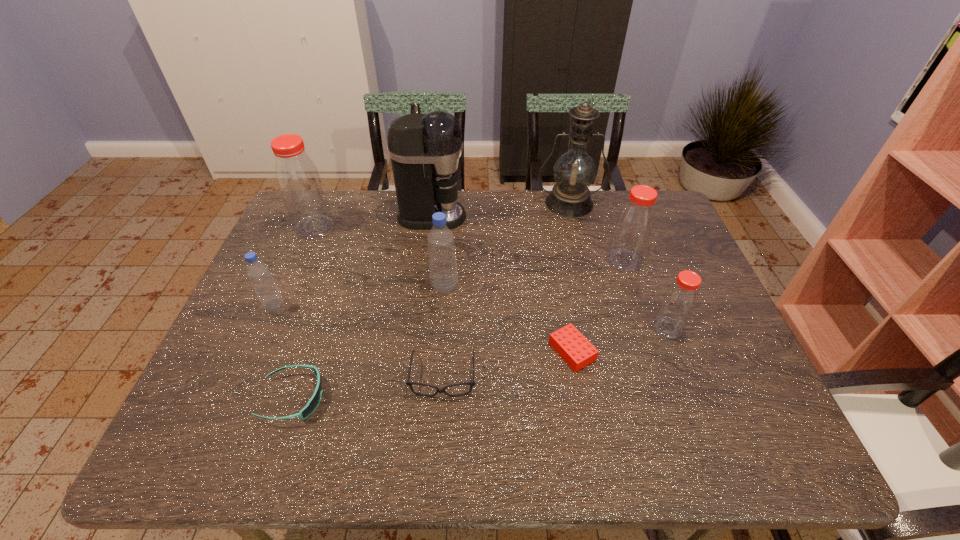
This screenshot has height=540, width=960. I want to click on gray oil lamp, so click(x=574, y=171).

Find the location of a particular element. coffee maker is located at coordinates (425, 150).

In order to click on the eighth shortest object in this screenshot , I will do `click(299, 182)`.

The height and width of the screenshot is (540, 960). Find the location of `the leftmost red bottle`. the leftmost red bottle is located at coordinates (299, 182).

Locate an element on the screen. This screenshot has width=960, height=540. the sixth nearest object is located at coordinates (443, 272).

Locate an element on the screen. This screenshot has width=960, height=540. the right blue bottle is located at coordinates (443, 272).

Find the location of a particular element. This screenshot has height=540, width=960. the second biggest red bottle is located at coordinates (634, 224).

In order to click on the second farthest red bottle in this screenshot , I will do `click(634, 224)`.

Identify the location of the nearest bottle. The height and width of the screenshot is (540, 960). (679, 301).

Identify the location of the nearest red bottle. This screenshot has height=540, width=960. (679, 301).